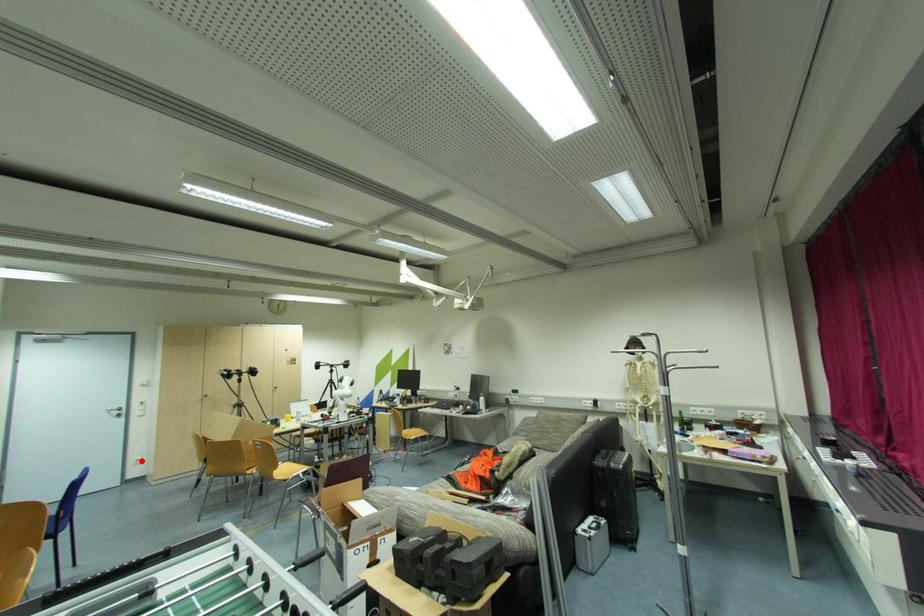
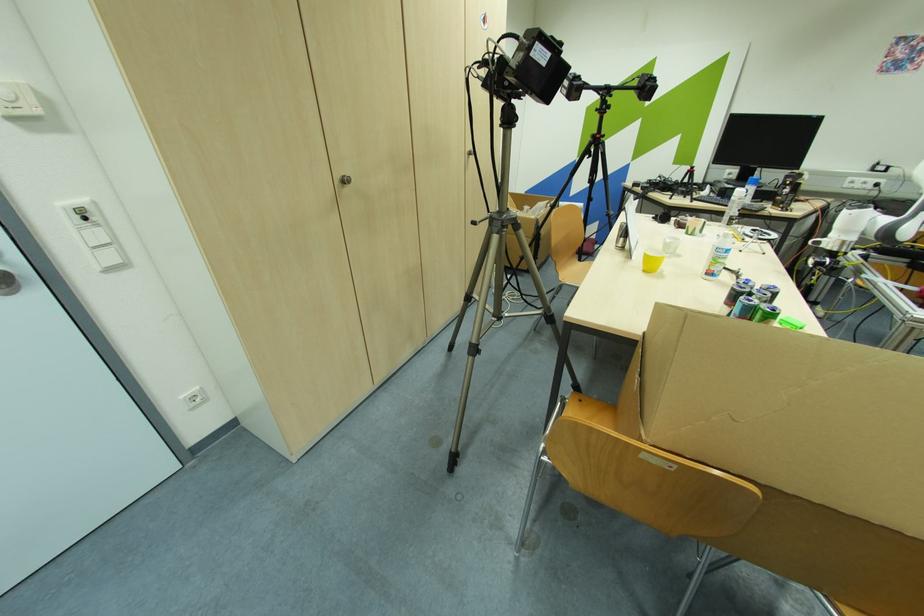
Find the pixel in the second image that matches the highlighted location in the first image.

(198, 399)